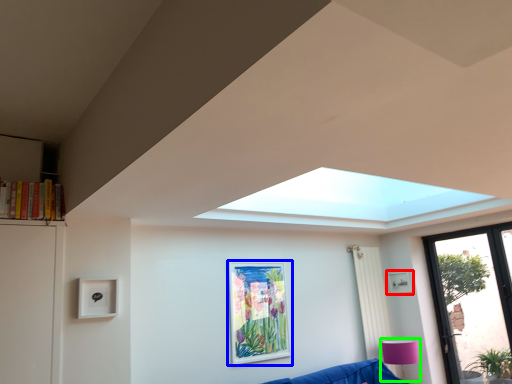
Question: Which is nearer to the picture frame (highlighted by a red box)? picture frame (highlighted by a blue box) or lamp (highlighted by a green box).

Choices:
 (A) picture frame
 (B) lamp

Answer: (B)